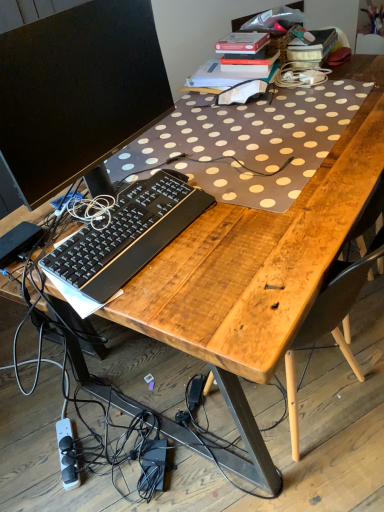
Question: Is white plastic power strip at lower left wider or thinner than black matte computer monitor at upper left?

Choices:
 (A) wide
 (B) thin

Answer: (A)

Question: In terms of height, does white plastic power strip at lower left look taller or shorter compared to black matte computer monitor at upper left?

Choices:
 (A) tall
 (B) short

Answer: (B)

Question: Considering the real-world distances, which object is farthest from the black matte computer monitor at upper left?

Choices:
 (A) black plastic keyboard at center
 (B) white plastic power strip at lower left

Answer: (B)

Question: Which object is the closest to the white plastic power strip at lower left?

Choices:
 (A) black matte computer monitor at upper left
 (B) black plastic keyboard at center

Answer: (B)